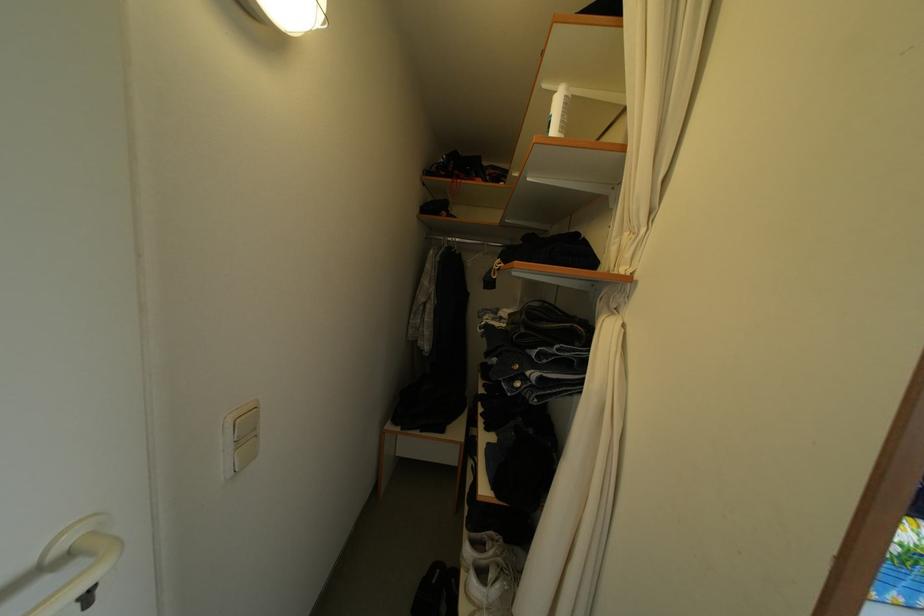
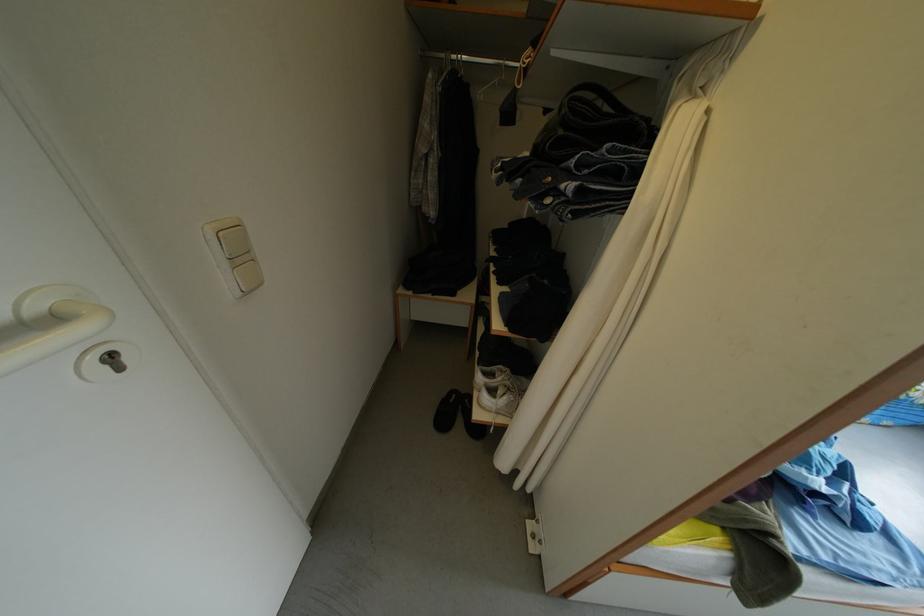
In the second image, find the point that corresponds to (592,391) in the first image.

(639, 204)